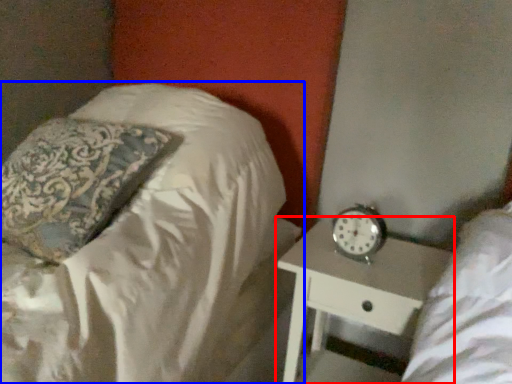
Question: Which point is further to the camera, nightstand (highlighted by a red box) or bed (highlighted by a blue box)?

Choices:
 (A) nightstand
 (B) bed

Answer: (A)